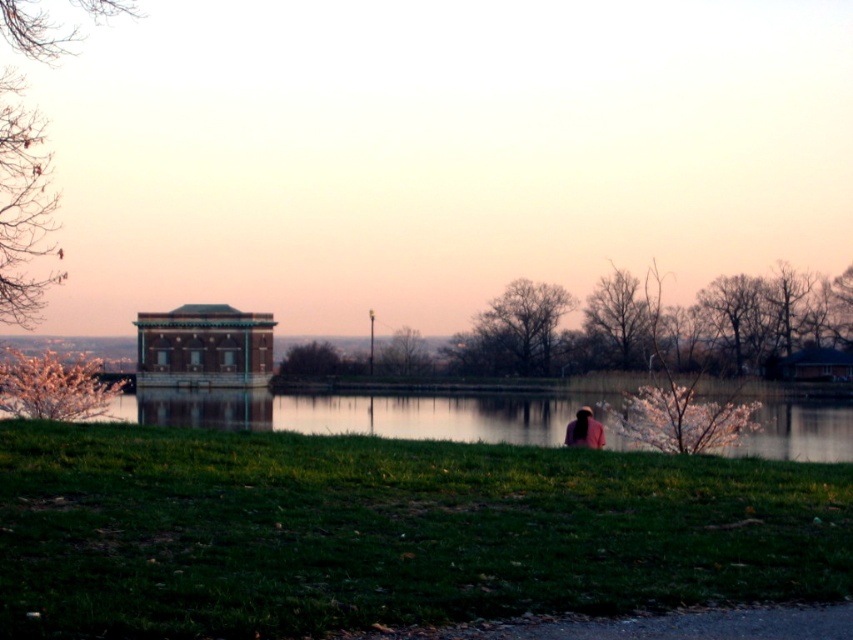
Consider the image. Which of these two, green grass at lower center or matte gray gazebo at center, stands shorter?

green grass at lower center is shorter.

Describe the element at coordinates (363, 413) in the screenshot. This screenshot has height=640, width=853. I see `green grass at lower center` at that location.

Locate an element on the screen. The width and height of the screenshot is (853, 640). green grass at lower center is located at coordinates (363, 413).